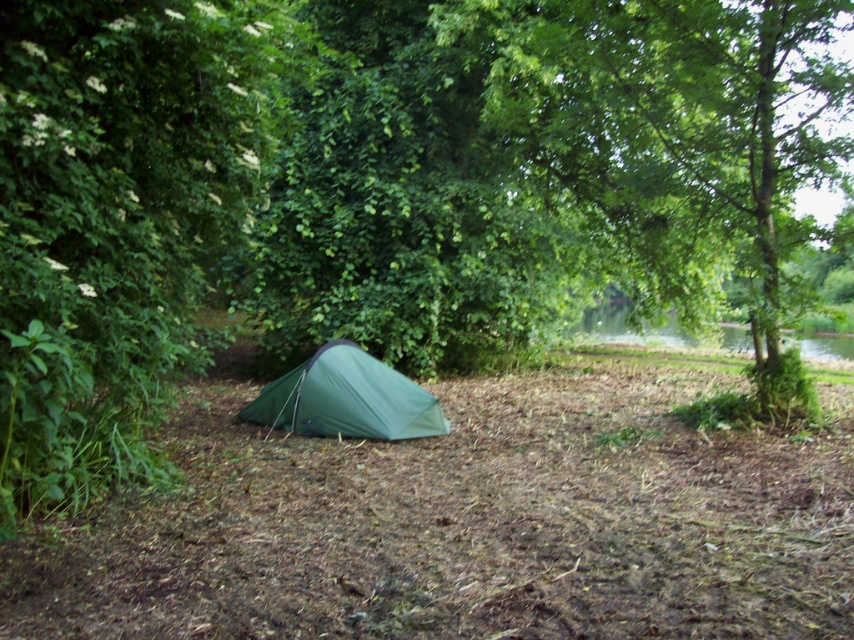
Question: Which point is closer to the camera?

Choices:
 (A) (266, 416)
 (B) (578, 54)

Answer: (A)

Question: Does green leafy tree at center appear on the left side of green fabric tent at center?

Choices:
 (A) yes
 (B) no

Answer: (B)

Question: Is green leafy tree at center behind green fabric tent at center?

Choices:
 (A) yes
 (B) no

Answer: (A)

Question: Which object appears closest to the camera in this image?

Choices:
 (A) green leafy tree at center
 (B) green fabric tent at center

Answer: (B)

Question: Where is green leafy tree at center located in relation to green fabric tent at center in the image?

Choices:
 (A) below
 (B) above

Answer: (B)